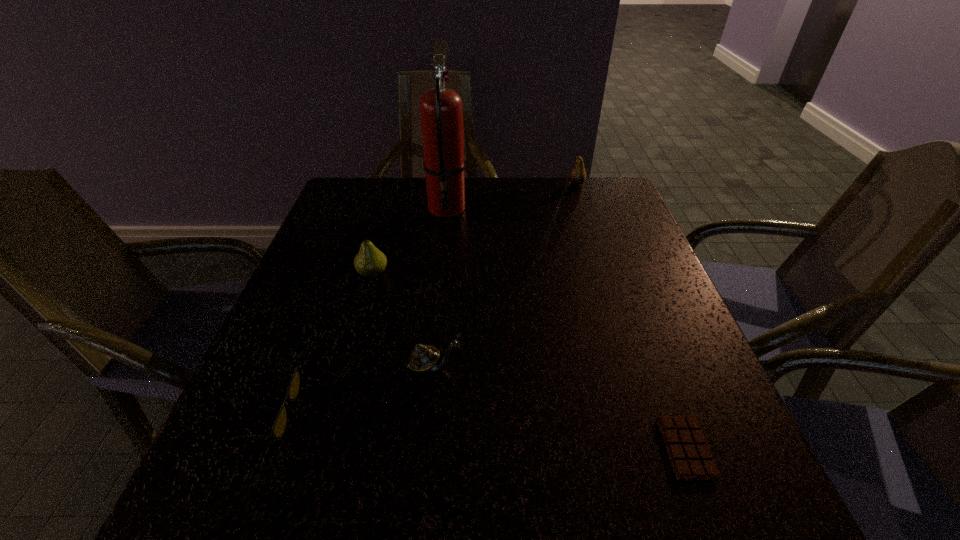
Identify the location of the second farthest object. The image size is (960, 540). (441, 110).

The height and width of the screenshot is (540, 960). I want to click on the tallest object, so click(441, 110).

This screenshot has height=540, width=960. What are the coordinates of `the right pear` in the screenshot? It's located at (577, 176).

Locate an element on the screen. Image resolution: width=960 pixels, height=540 pixels. the farthest object is located at coordinates (577, 176).

Identify the location of the fifth object from right to left. (370, 262).

Locate an element on the screen. This screenshot has width=960, height=540. the third farthest object is located at coordinates (370, 262).

Identify the location of snail. (424, 358).

You are a GUI agent. You are given a task and a screenshot of the screen. Output one action in this format:
    pyautogui.click(x=<x>, y=<y>)
    Task: Click on the fifth tallest object
    
    Given the screenshot: What is the action you would take?
    pyautogui.click(x=279, y=426)

You are a GUI agent. You are given a task and a screenshot of the screen. Output one action in this format:
    pyautogui.click(x=<x>, y=<y>)
    Task: Click on the leftmost object
    Image resolution: width=960 pixels, height=540 pixels.
    Given the screenshot: What is the action you would take?
    pyautogui.click(x=279, y=426)

This screenshot has height=540, width=960. In order to click on candy bar in this screenshot , I will do `click(689, 453)`.